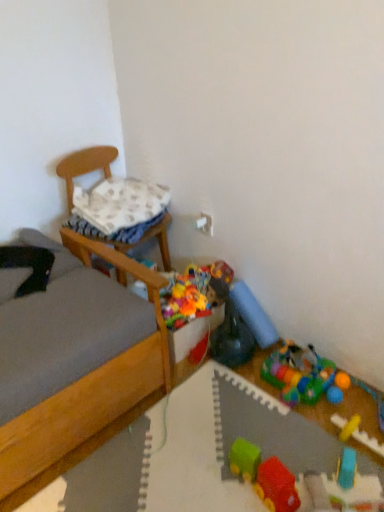
Locate an element on the screen. vacant area that lies to the right of rubberized plastic train at center, the 1th toy in the front-to-back sequence is located at coordinates (306, 456).